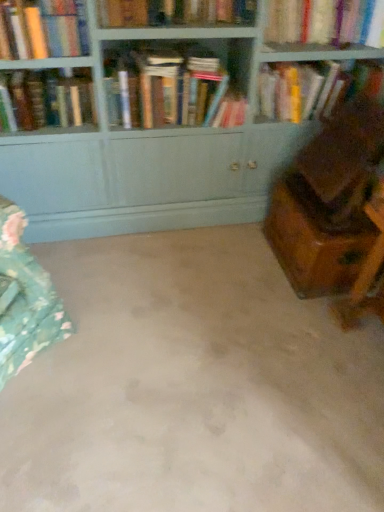
Question: From the image's perspective, is wooden chest at right on hardcover book at upper left, which is the second book from left to right?

Choices:
 (A) yes
 (B) no

Answer: (B)

Question: Could you tell me if wooden chest at right is facing hardcover book at upper left, which is the second book from left to right?

Choices:
 (A) yes
 (B) no

Answer: (B)

Question: Considering the relative sizes of wooden chest at right and hardcover book at upper left, which ranks as the fifth book in right-to-left order, in the image provided, is wooden chest at right bigger than hardcover book at upper left, which ranks as the fifth book in right-to-left order,?

Choices:
 (A) yes
 (B) no

Answer: (A)

Question: Is wooden chest at right wider than hardcover book at upper left, which ranks as the fifth book in right-to-left order?

Choices:
 (A) yes
 (B) no

Answer: (A)

Question: From a real-world perspective, is wooden chest at right located beneath hardcover book at upper left, which ranks as the fifth book in right-to-left order?

Choices:
 (A) yes
 (B) no

Answer: (A)

Question: Considering the relative sizes of wooden chest at right and hardcover book at upper left, which ranks as the fifth book in right-to-left order, in the image provided, is wooden chest at right thinner than hardcover book at upper left, which ranks as the fifth book in right-to-left order,?

Choices:
 (A) yes
 (B) no

Answer: (B)

Question: From the image's perspective, is beige carpet at center located beneath hardcover book at upper left, which appears as the first book when viewed from the left?

Choices:
 (A) no
 (B) yes

Answer: (B)

Question: Considering the relative sizes of beige carpet at center and hardcover book at upper left, which appears as the 6th book when viewed from the right, in the image provided, is beige carpet at center thinner than hardcover book at upper left, which appears as the 6th book when viewed from the right,?

Choices:
 (A) no
 (B) yes

Answer: (A)

Question: Can you confirm if beige carpet at center is taller than hardcover book at upper left, which appears as the 6th book when viewed from the right?

Choices:
 (A) yes
 (B) no

Answer: (B)

Question: Is beige carpet at center facing towards hardcover book at upper left, which appears as the 6th book when viewed from the right?

Choices:
 (A) yes
 (B) no

Answer: (B)

Question: Is there a large distance between beige carpet at center and hardcover book at upper left, which appears as the 6th book when viewed from the right?

Choices:
 (A) yes
 (B) no

Answer: (A)

Question: Does beige carpet at center appear on the right side of hardcover book at upper left, which appears as the 6th book when viewed from the right?

Choices:
 (A) yes
 (B) no

Answer: (A)

Question: From a real-world perspective, is matte wood bookcase at upper center positioned over hardcover book at upper left, which appears as the first book when viewed from the left, based on gravity?

Choices:
 (A) yes
 (B) no

Answer: (B)